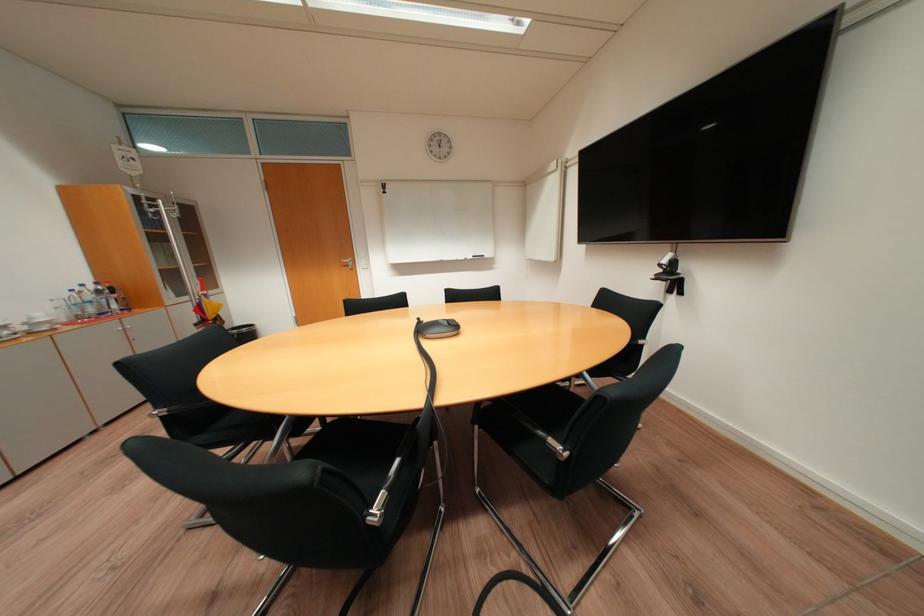
Find where to placing arm the metallic chair armrest. Please return your answer as a coordinate pair (x, y).

(540, 440)